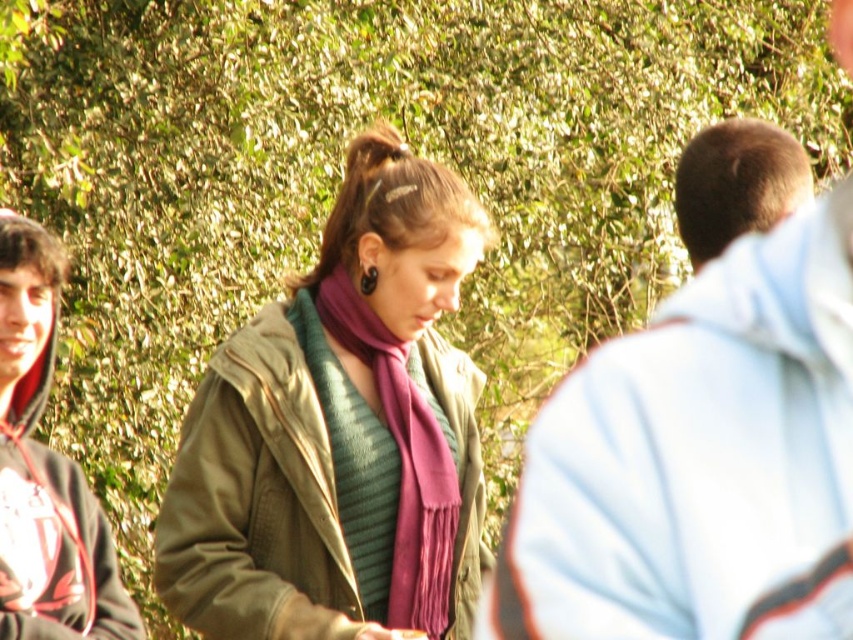
You are a photographer trying to capture a detailed shot of the purple silky scarf at center and the light blue hoodie at right. Since you want both subjects in focus, which one should you adjust your camera focus on first to ensure clarity?

The light blue hoodie at right is closer to the viewer than the purple silky scarf at center. To ensure both are in focus, you should focus on the light blue hoodie at right first, as focusing on the closer object allows the background to be in focus as well.

You are a photographer taking a picture of the group. You notice the matte green jacket at center and the brown hair at right. Which object is closer to you in the photo?

The matte green jacket at center is closer to you because it is further to the viewer than the brown hair at right, meaning it appears nearer in the photo.